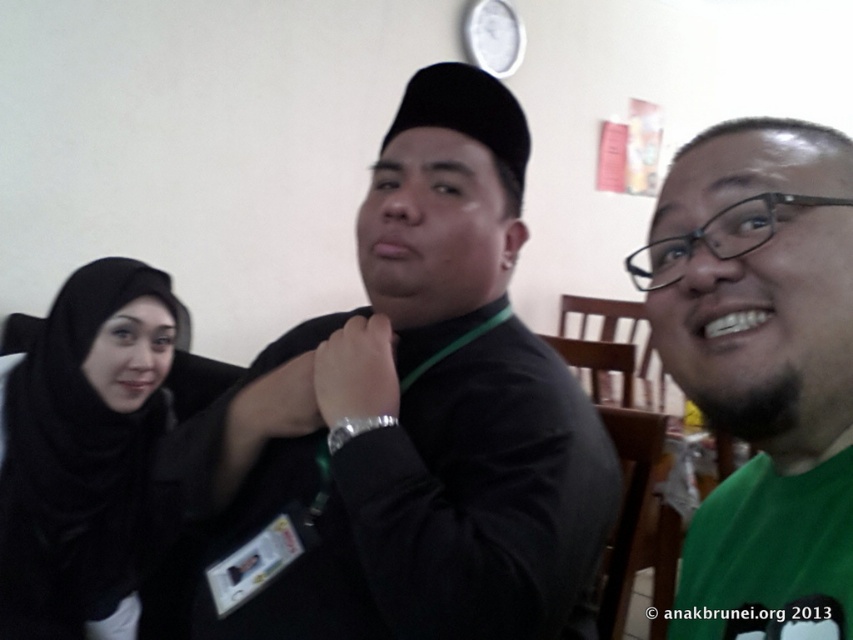
Can you confirm if black matte shirt at center is thinner than black matte hijab at left?

No.

Between point (425, 586) and point (143, 403), which one is positioned in front?

Positioned in front is point (425, 586).

Between point (561, 472) and point (109, 496), which one is positioned behind?

Point (109, 496)

At what (x,y) coordinates should I click in order to perform the action: click on black matte shirt at center. Please return your answer as a coordinate pair (x, y). This screenshot has width=853, height=640. Looking at the image, I should click on pos(399,428).

Is point (772, 595) more distant than point (59, 637)?

No, (772, 595) is in front of (59, 637).

Between green matte shirt at right and black matte hijab at left, which one is positioned lower?

black matte hijab at left is below.

Does point (741, 384) come behind point (160, 426)?

No, it is in front of (160, 426).

This screenshot has height=640, width=853. What are the coordinates of `green matte shirt at right` in the screenshot? It's located at (762, 369).

Measure the distance from black matte shirt at center to green matte shirt at right.

The distance of black matte shirt at center from green matte shirt at right is 11.61 inches.

Is black matte shirt at center below green matte shirt at right?

Indeed, black matte shirt at center is positioned under green matte shirt at right.

You are a GUI agent. You are given a task and a screenshot of the screen. Output one action in this format:
    pyautogui.click(x=<x>, y=<y>)
    Task: Click on the black matte shirt at center
    This screenshot has width=853, height=640.
    Given the screenshot: What is the action you would take?
    pyautogui.click(x=399, y=428)

The width and height of the screenshot is (853, 640). In order to click on black matte shirt at center in this screenshot , I will do `click(399, 428)`.